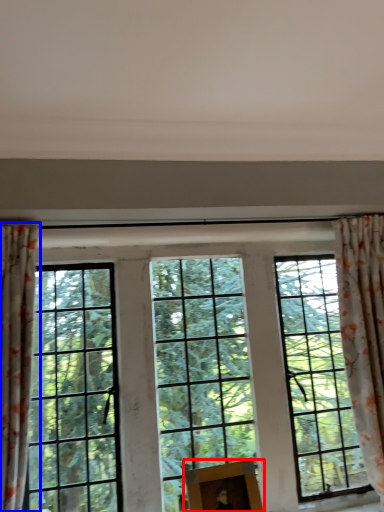
Question: Which object appears farthest to the camera in this image, picture frame (highlighted by a red box) or curtain (highlighted by a blue box)?

Choices:
 (A) picture frame
 (B) curtain

Answer: (A)